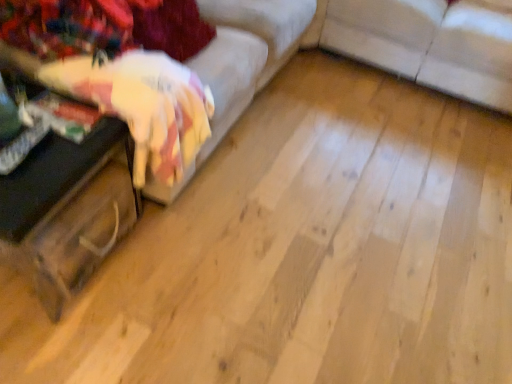
Question: From a real-world perspective, is white fabric couch at center, placed as the first studio couch when sorted from right to left, located beneath wooden trunk at left?

Choices:
 (A) no
 (B) yes

Answer: (A)

Question: From a real-world perspective, is white fabric couch at center, placed as the first studio couch when sorted from right to left, located higher than wooden trunk at left?

Choices:
 (A) no
 (B) yes

Answer: (B)

Question: Is white fabric couch at center, positioned as the 2th studio couch in left-to-right order, oriented towards wooden trunk at left?

Choices:
 (A) no
 (B) yes

Answer: (B)

Question: Considering the relative sizes of white fabric couch at center, positioned as the 2th studio couch in left-to-right order, and wooden trunk at left in the image provided, is white fabric couch at center, positioned as the 2th studio couch in left-to-right order, smaller than wooden trunk at left?

Choices:
 (A) yes
 (B) no

Answer: (B)

Question: Considering the relative positions of white fabric couch at center, placed as the first studio couch when sorted from right to left, and wooden trunk at left in the image provided, is white fabric couch at center, placed as the first studio couch when sorted from right to left, in front of wooden trunk at left?

Choices:
 (A) yes
 (B) no

Answer: (B)

Question: Is white fabric couch at center, placed as the first studio couch when sorted from right to left, thinner than wooden trunk at left?

Choices:
 (A) yes
 (B) no

Answer: (B)

Question: Can you confirm if wooden trunk at left is positioned to the left of white fabric couch at center, positioned as the 2th studio couch in left-to-right order?

Choices:
 (A) yes
 (B) no

Answer: (A)

Question: Can you confirm if wooden trunk at left is thinner than white fabric couch at center, positioned as the 2th studio couch in left-to-right order?

Choices:
 (A) yes
 (B) no

Answer: (A)

Question: Is wooden trunk at left far from white fabric couch at center, positioned as the 2th studio couch in left-to-right order?

Choices:
 (A) yes
 (B) no

Answer: (A)

Question: Is wooden trunk at left behind white fabric couch at center, positioned as the 2th studio couch in left-to-right order?

Choices:
 (A) no
 (B) yes

Answer: (A)

Question: Can you confirm if wooden trunk at left is wider than white fabric couch at center, positioned as the 2th studio couch in left-to-right order?

Choices:
 (A) no
 (B) yes

Answer: (A)

Question: Can you confirm if wooden trunk at left is bigger than white fabric couch at center, placed as the first studio couch when sorted from right to left?

Choices:
 (A) yes
 (B) no

Answer: (B)

Question: Is velvet fabric couch at left, positioned as the first studio couch in left-to-right order, far from wooden trunk at left?

Choices:
 (A) no
 (B) yes

Answer: (A)